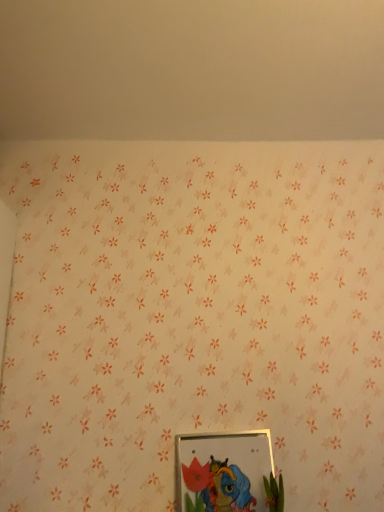
I want to click on metallic gold picture frame at lower center, so pyautogui.click(x=223, y=471).

Image resolution: width=384 pixels, height=512 pixels. What do you see at coordinates (223, 471) in the screenshot?
I see `metallic gold picture frame at lower center` at bounding box center [223, 471].

Locate an element on the screen. This screenshot has height=512, width=384. metallic gold picture frame at lower center is located at coordinates (223, 471).